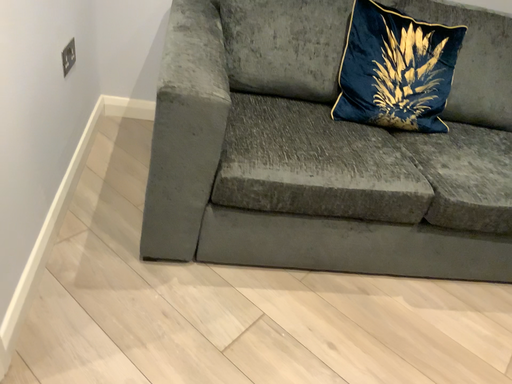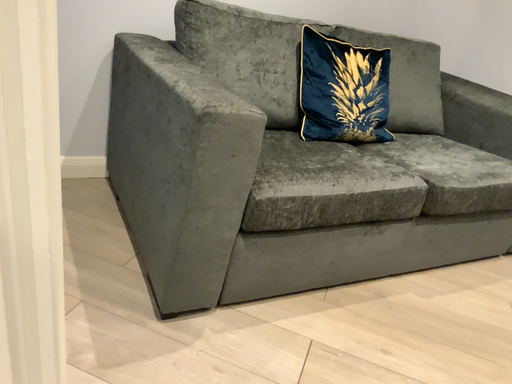
Question: How did the camera likely rotate when shooting the video?

Choices:
 (A) rotated downward
 (B) rotated upward

Answer: (B)